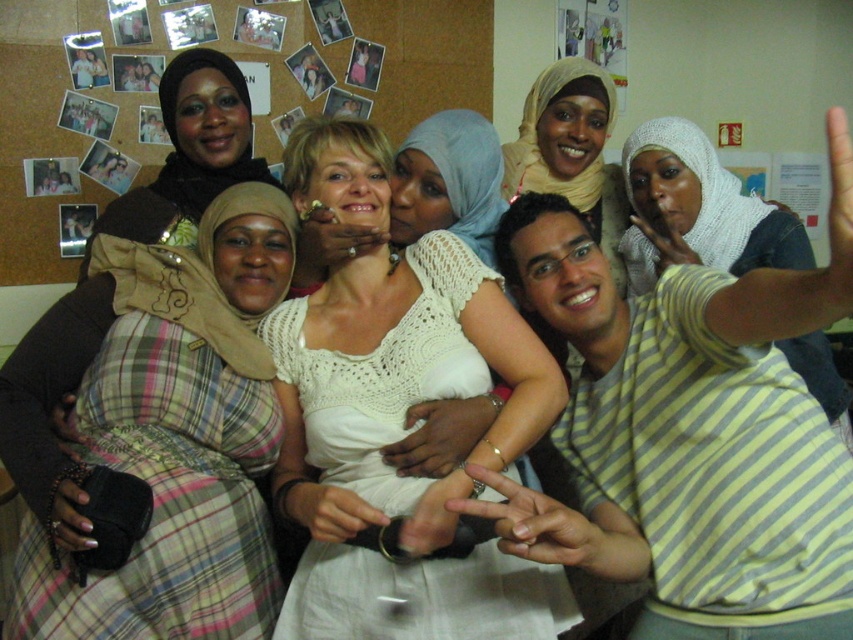
Question: Which of these objects is positioned closest to the matte brown scarf at upper left?

Choices:
 (A) smooth beige fabric at center
 (B) smooth skin hand at center
 (C) matte beige hijab at upper center
 (D) white fabric hand at center

Answer: (C)

Question: Which object is farther from the camera taking this photo?

Choices:
 (A) white fabric hand at center
 (B) white lace hand at center

Answer: (A)

Question: Can you confirm if yellow striped shirt at center is wider than plaid fabric dress at left?

Choices:
 (A) no
 (B) yes

Answer: (B)

Question: Does white crochet top at center lie in front of smooth skin hand at center?

Choices:
 (A) no
 (B) yes

Answer: (A)

Question: Can you confirm if yellow striped shirt at center is smaller than matte beige hijab at upper center?

Choices:
 (A) no
 (B) yes

Answer: (A)

Question: Which object appears closest to the camera in this image?

Choices:
 (A) matte beige hijab at upper center
 (B) white lace hand at center
 (C) white crochet top at center
 (D) matte brown scarf at upper left

Answer: (C)